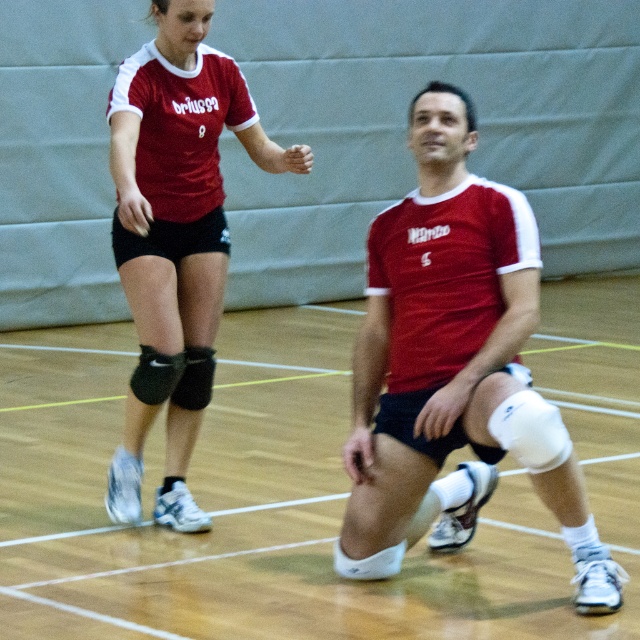
Who is more forward, (x=484, y=237) or (x=179, y=502)?

Positioned in front is point (x=484, y=237).

Is matte red jersey at center shorter than matte red jersey at upper left?

Indeed, matte red jersey at center has a lesser height compared to matte red jersey at upper left.

The width and height of the screenshot is (640, 640). Describe the element at coordinates (452, 364) in the screenshot. I see `matte red jersey at center` at that location.

I want to click on matte red jersey at center, so click(452, 364).

Who is more forward, (116, 269) or (150, 404)?

Point (150, 404) is more forward.

The width and height of the screenshot is (640, 640). In order to click on matte red jersey at upper left in this screenshot , I will do `click(179, 211)`.

Where is `matte red jersey at upper left`? The height and width of the screenshot is (640, 640). matte red jersey at upper left is located at coordinates (179, 211).

Is matte red jersey at center thinner than black matte knee pad at lower left?

In fact, matte red jersey at center might be wider than black matte knee pad at lower left.

Does matte red jersey at center appear on the right side of black matte knee pad at lower left?

Correct, you'll find matte red jersey at center to the right of black matte knee pad at lower left.

Locate an element on the screen. This screenshot has width=640, height=640. matte red jersey at center is located at coordinates (452, 364).